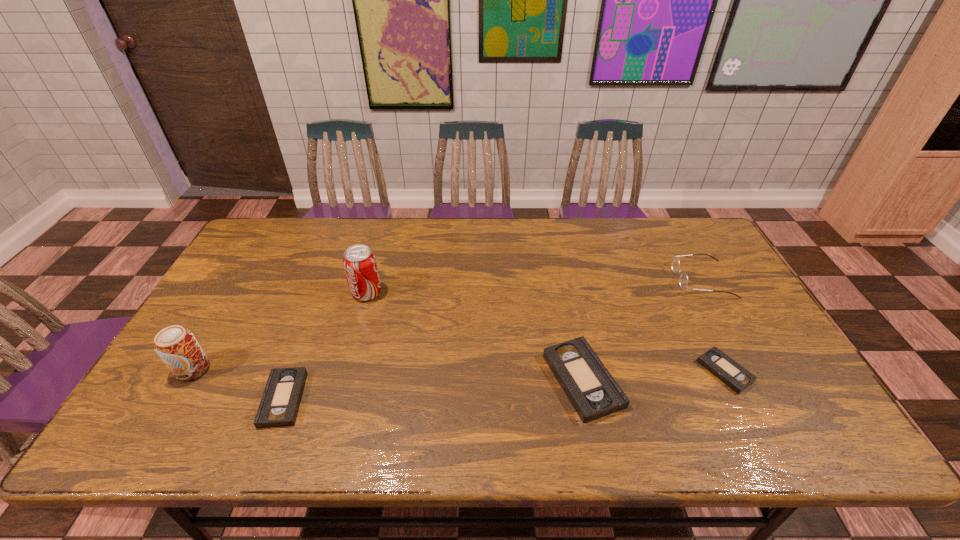
Please determine a free point for an extra videotape to ensure balance. Please provide its 2D coordinates. Your answer should be formatted as a tuple, i.e. [(x, y)], where the tuple contains the x and y coordinates of a point satisfying the conditions above.

[(436, 389)]